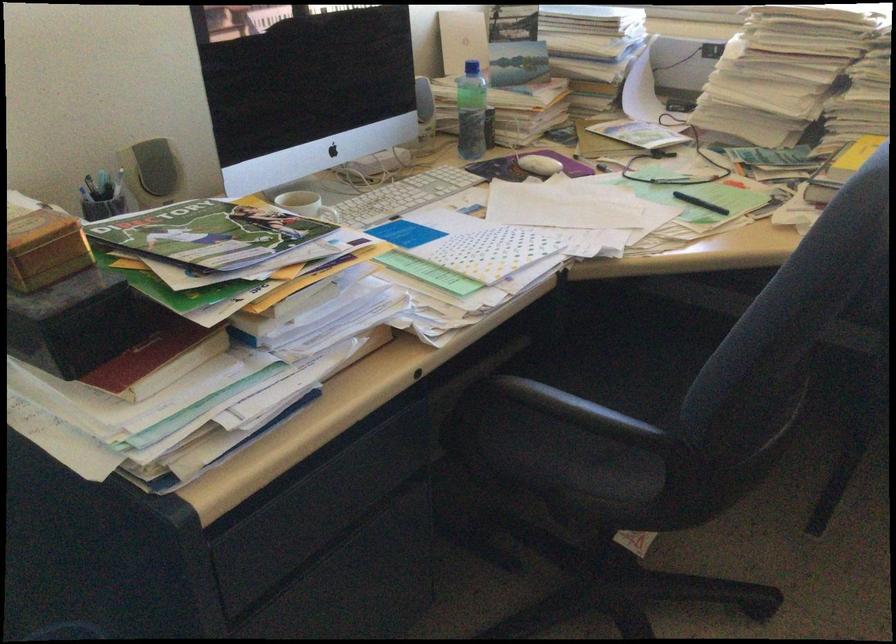
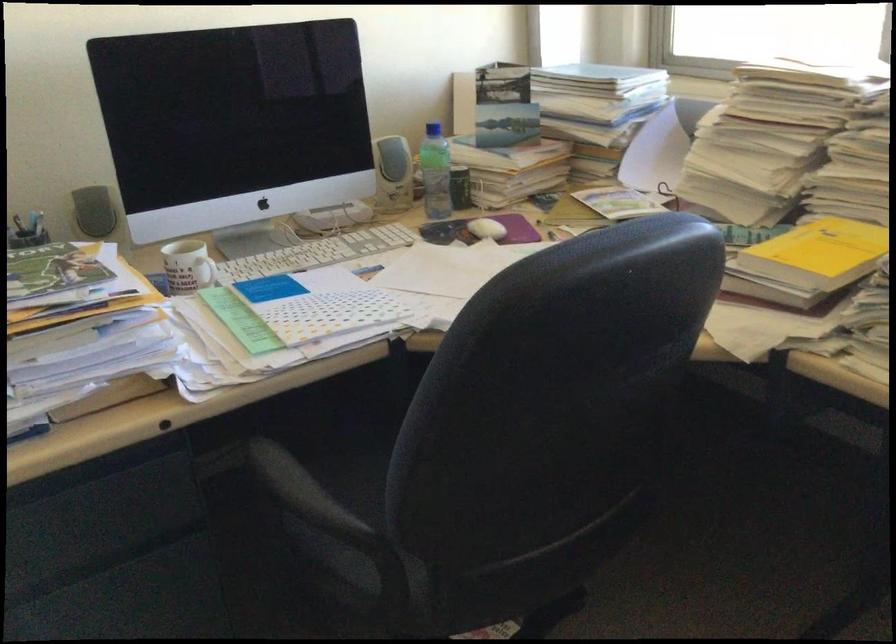
Question: The camera is either moving clockwise (left) or counter-clockwise (right) around the object. The first image is from the beginning of the video and the second image is from the end. Is the camera moving left or right when shooting the video?

Choices:
 (A) Left
 (B) Right

Answer: (B)